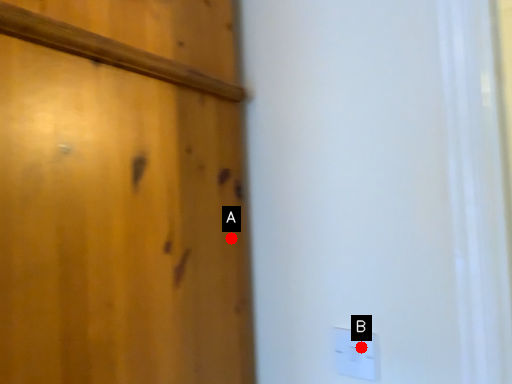
Question: Two points are circled on the image, labeled by A and B beside each circle. Which point is further to the camera?

Choices:
 (A) A is further
 (B) B is further

Answer: (A)